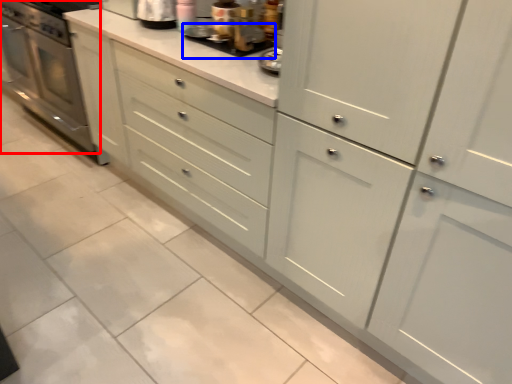
Question: Which object appears farthest to the camera in this image, home appliance (highlighted by a red box) or appliance (highlighted by a blue box)?

Choices:
 (A) home appliance
 (B) appliance

Answer: (A)